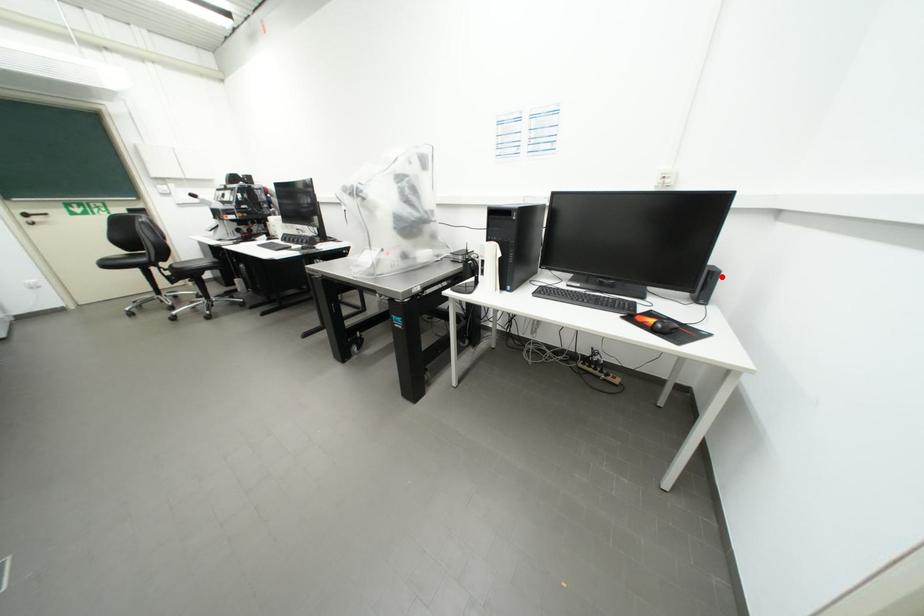
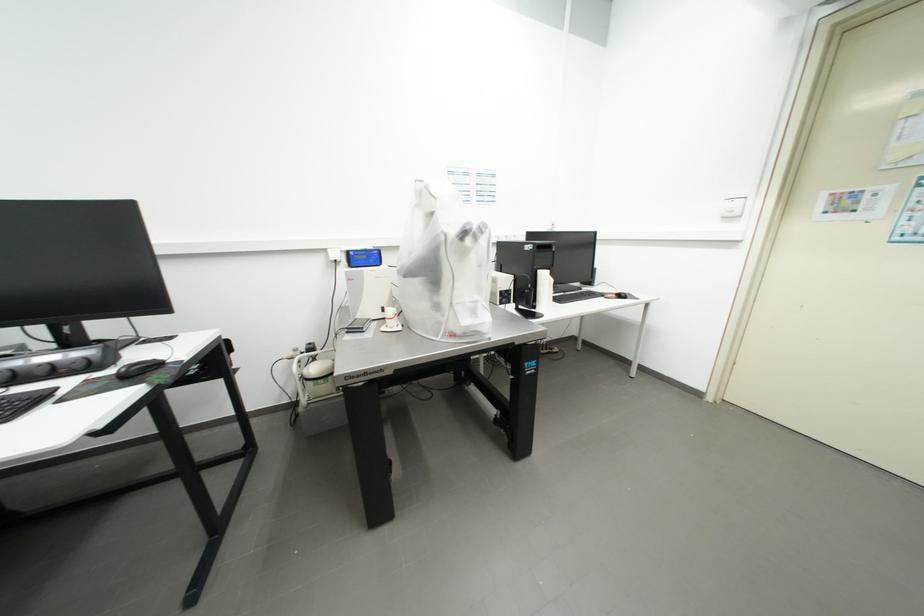
Question: I am providing you with two images of the same scene from different viewpoints. A red point is marked on the first image. At the location where the point appears in image 1, is it still visible in image 2?

Choices:
 (A) Yes
 (B) No

Answer: (B)